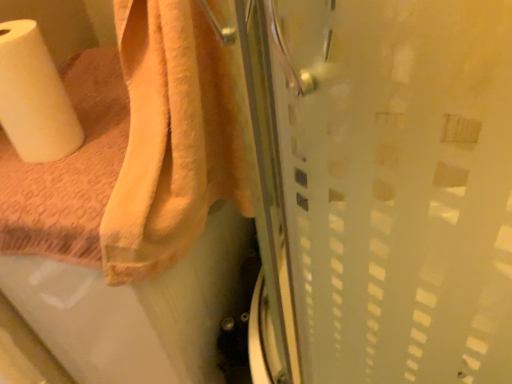
Locate an element on the screen. The image size is (512, 384). white matte paper towel at left is located at coordinates (34, 97).

The height and width of the screenshot is (384, 512). Describe the element at coordinates (34, 97) in the screenshot. I see `white matte paper towel at left` at that location.

Image resolution: width=512 pixels, height=384 pixels. Describe the element at coordinates (170, 139) in the screenshot. I see `orange cotton towel at upper left` at that location.

I want to click on orange cotton towel at upper left, so click(170, 139).

Where is `white matte paper towel at left`? Image resolution: width=512 pixels, height=384 pixels. white matte paper towel at left is located at coordinates (34, 97).

Is orange cotton towel at upper left to the left of white matte paper towel at left from the viewer's perspective?

No, orange cotton towel at upper left is not to the left of white matte paper towel at left.

In the image, is orange cotton towel at upper left positioned in front of or behind white matte paper towel at left?

Clearly, orange cotton towel at upper left is in front of white matte paper towel at left.

Which is closer to the camera, (188,160) or (38,60)?

Positioned in front is point (188,160).

From the image's perspective, is orange cotton towel at upper left under white matte paper towel at left?

Yes.

From a real-world perspective, is orange cotton towel at upper left physically below white matte paper towel at left?

Yes, from a real-world perspective, orange cotton towel at upper left is below white matte paper towel at left.

Considering the sizes of objects orange cotton towel at upper left and white matte paper towel at left in the image provided, who is thinner, orange cotton towel at upper left or white matte paper towel at left?

Thinner between the two is white matte paper towel at left.

Considering the sizes of orange cotton towel at upper left and white matte paper towel at left in the image, is orange cotton towel at upper left taller or shorter than white matte paper towel at left?

orange cotton towel at upper left is taller than white matte paper towel at left.

Who is smaller, orange cotton towel at upper left or white matte paper towel at left?

white matte paper towel at left is smaller.

Would you say orange cotton towel at upper left contains white matte paper towel at left?

That's incorrect, white matte paper towel at left is not inside orange cotton towel at upper left.

Is orange cotton towel at upper left touching white matte paper towel at left?

No, orange cotton towel at upper left is not making contact with white matte paper towel at left.

Is white matte paper towel at left at the back of orange cotton towel at upper left?

orange cotton towel at upper left is not turned away from white matte paper towel at left.

Image resolution: width=512 pixels, height=384 pixels. In order to click on paper towel behind the orange cotton towel at upper left in this screenshot , I will do `click(34, 97)`.

Considering the positions of objects white matte paper towel at left and orange cotton towel at upper left in the image provided, who is more to the left, white matte paper towel at left or orange cotton towel at upper left?

From the viewer's perspective, white matte paper towel at left appears more on the left side.

Is white matte paper towel at left in front of or behind orange cotton towel at upper left in the image?

Clearly, white matte paper towel at left is behind orange cotton towel at upper left.

Based on the photo, which is closer to the camera, (x=56, y=109) or (x=168, y=75)?

The point (x=168, y=75) is closer.

From the image's perspective, would you say white matte paper towel at left is positioned over orange cotton towel at upper left?

Yes, from the image's perspective, white matte paper towel at left is over orange cotton towel at upper left.

Looking at this image, from a real-world perspective, is white matte paper towel at left positioned above or below orange cotton towel at upper left?

white matte paper towel at left is above orange cotton towel at upper left.

Is white matte paper towel at left wider than orange cotton towel at upper left?

No.

Considering the sizes of objects white matte paper towel at left and orange cotton towel at upper left in the image provided, who is taller, white matte paper towel at left or orange cotton towel at upper left?

With more height is orange cotton towel at upper left.

Which of these two, white matte paper towel at left or orange cotton towel at upper left, is bigger?

With larger size is orange cotton towel at upper left.

Is white matte paper towel at left located outside orange cotton towel at upper left?

That's correct, white matte paper towel at left is outside of orange cotton towel at upper left.

Consider the image. Does white matte paper towel at left touch orange cotton towel at upper left?

No, white matte paper towel at left is not next to orange cotton towel at upper left.

Is white matte paper towel at left facing away from orange cotton towel at upper left?

No, white matte paper towel at left is not facing the opposite direction of orange cotton towel at upper left.

What's the angular difference between white matte paper towel at left and orange cotton towel at upper left's facing directions?

The angle between the facing direction of white matte paper towel at left and the facing direction of orange cotton towel at upper left is 0.0008 degrees.

From the picture: How far apart are white matte paper towel at left and orange cotton towel at upper left?

8.70 inches.

The width and height of the screenshot is (512, 384). What are the coordinates of `paper towel that appears behind the orange cotton towel at upper left` in the screenshot? It's located at (34, 97).

The width and height of the screenshot is (512, 384). Identify the location of paper towel behind the orange cotton towel at upper left. (34, 97).

The image size is (512, 384). In the image, there is a orange cotton towel at upper left. Identify the location of paper towel above it (from the image's perspective). (34, 97).